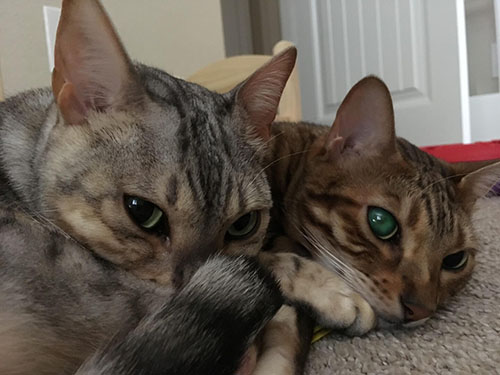
You are a GUI agent. You are given a task and a screenshot of the screen. Output one action in this format:
    pyautogui.click(x=<x>, y=<y>)
    Task: Click on the carpet
    The image size is (500, 375).
    Given the screenshot: What is the action you would take?
    pyautogui.click(x=453, y=357)